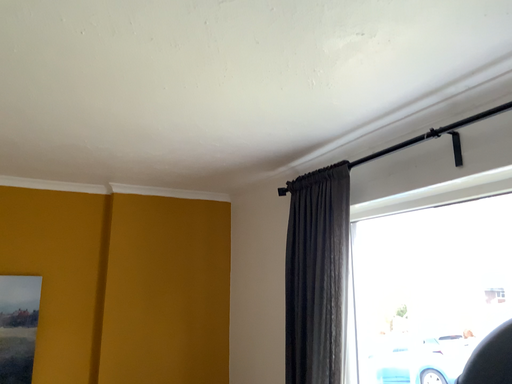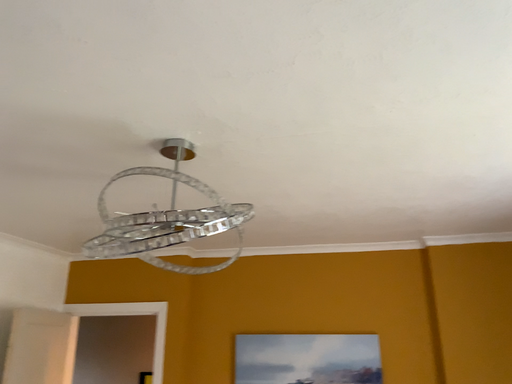
Question: Which way did the camera rotate in the video?

Choices:
 (A) rotated right
 (B) rotated left

Answer: (B)